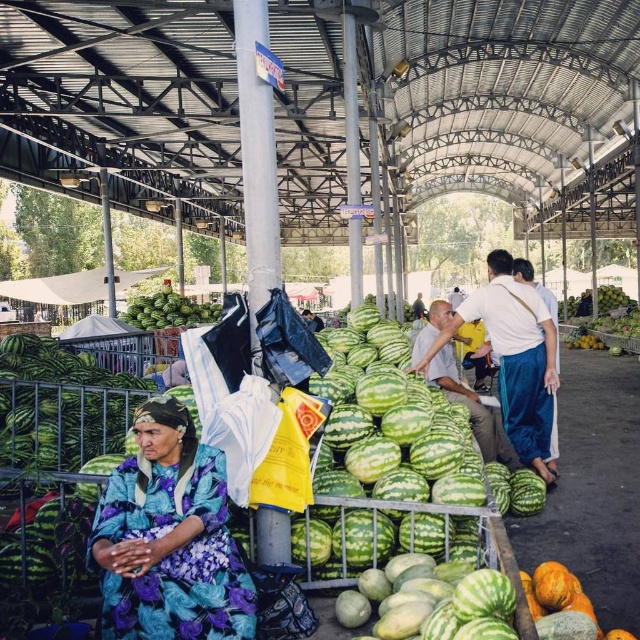
You are a customer at the market and see the smooth white shirt at center and the green matte watermelon at center. Which item is positioned higher up in the image?

The green matte watermelon at center is positioned higher up because the smooth white shirt at center is located below it.